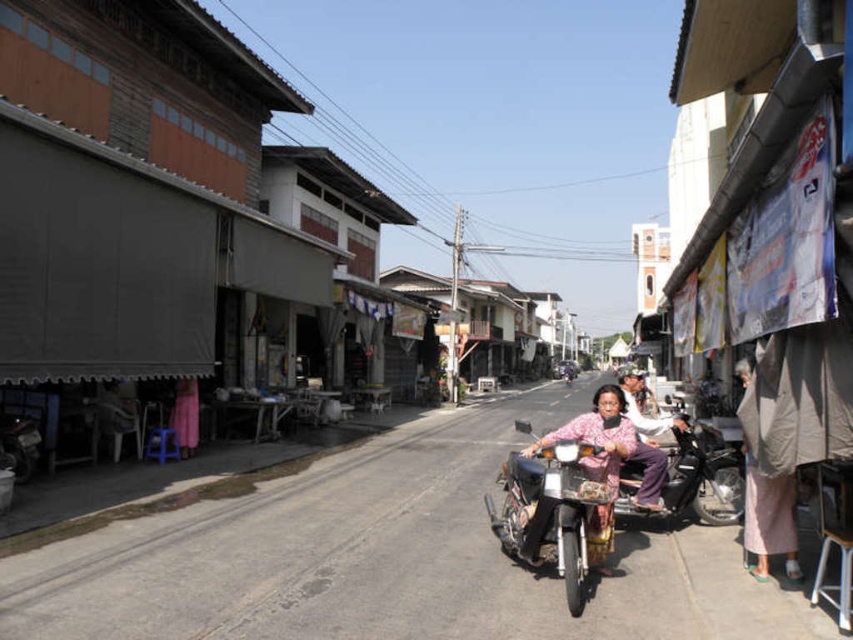
Does metallic silver motorcycle at center appear on the right side of matte pink pants at center?

No, metallic silver motorcycle at center is not to the right of matte pink pants at center.

Does point (573, 566) come behind point (657, 432)?

No, it is in front of (657, 432).

Where is `metallic silver motorcycle at center`? Image resolution: width=853 pixels, height=640 pixels. metallic silver motorcycle at center is located at coordinates (563, 499).

Between matte black motorcycle at center and matte pink pants at center, which one has more height?

Standing taller between the two is matte pink pants at center.

Between matte black motorcycle at center and matte pink pants at center, which one is positioned lower?

matte black motorcycle at center is lower down.

Between point (437, 509) and point (643, 412), which one is positioned in front?

Point (437, 509) is more forward.

At what (x,y) coordinates should I click in order to perform the action: click on matte black motorcycle at center. Please return your answer as a coordinate pair (x, y). This screenshot has height=640, width=853. Looking at the image, I should click on (386, 557).

Who is higher up, matte black motorcycle at center or metallic silver motorcycle at center?

metallic silver motorcycle at center is higher up.

Which is more to the left, matte black motorcycle at center or metallic silver motorcycle at center?

matte black motorcycle at center

The image size is (853, 640). Find the location of `matte black motorcycle at center`. matte black motorcycle at center is located at coordinates (386, 557).